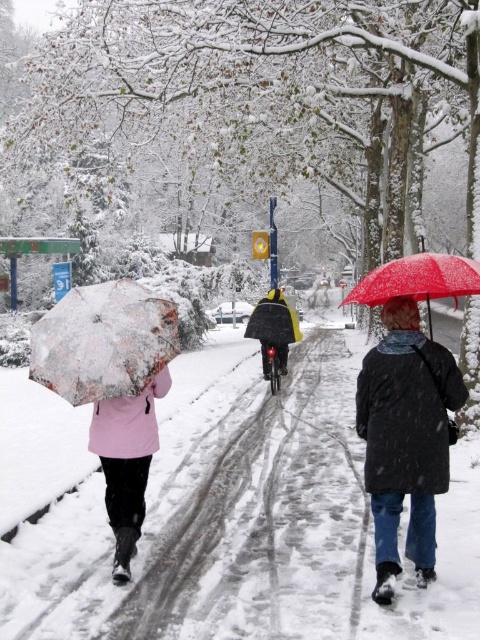
You are a delivery robot with a width of 1 meter. You need to navigate between the black matte coat at center and the matte pink coat at left to deliver a package. Can you fit through the space between them?

The distance between the black matte coat at center and the matte pink coat at left is 1.77 meters. Since the robot is 1 meter wide, it can fit through the space as there is enough width available.